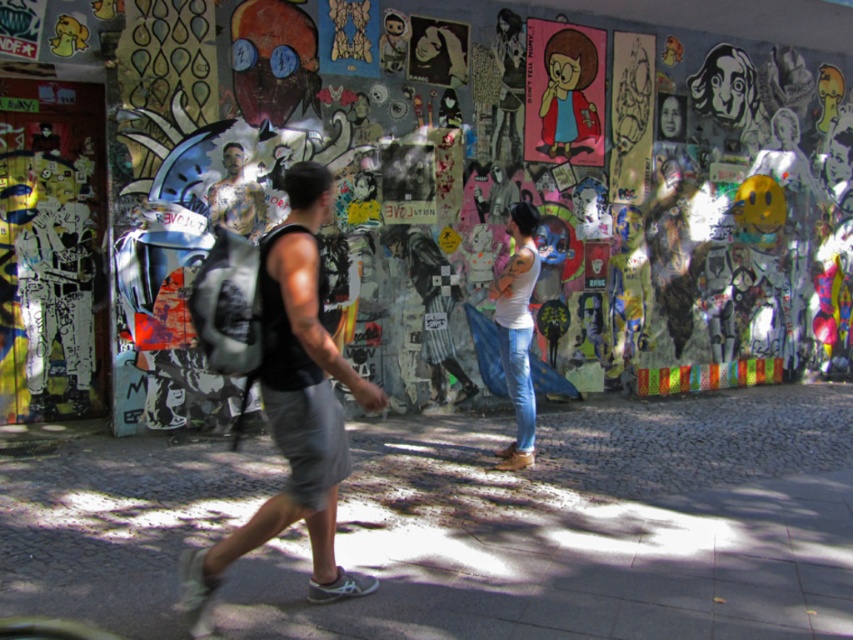
Does matte black backpack at left have a lesser height compared to black fabric backpack at center?

In fact, matte black backpack at left may be taller than black fabric backpack at center.

Where is `matte black backpack at left`? matte black backpack at left is located at coordinates (432, 193).

Image resolution: width=853 pixels, height=640 pixels. What do you see at coordinates (432, 193) in the screenshot?
I see `matte black backpack at left` at bounding box center [432, 193].

This screenshot has width=853, height=640. I want to click on matte black backpack at left, so click(x=432, y=193).